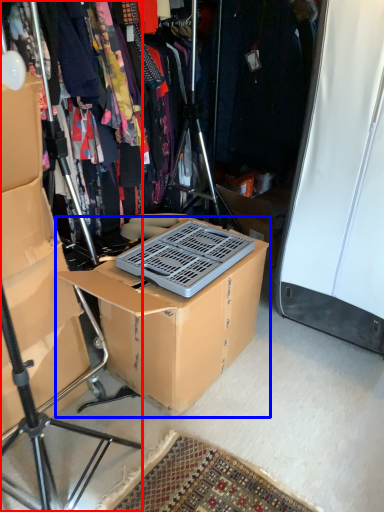
Question: Which point is further to the camera, tripod (highlighted by a red box) or box (highlighted by a blue box)?

Choices:
 (A) tripod
 (B) box

Answer: (B)